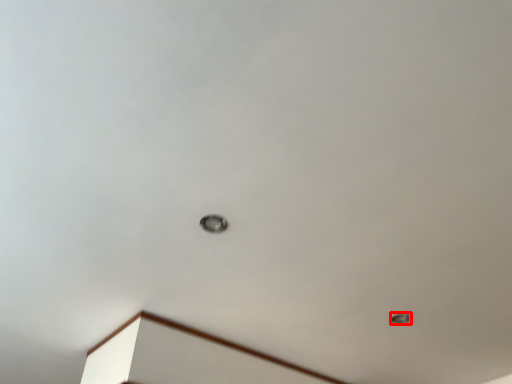
Question: From the image's perspective, where is lamp (annotated by the red box) located relative to lamp?

Choices:
 (A) above
 (B) below

Answer: (B)